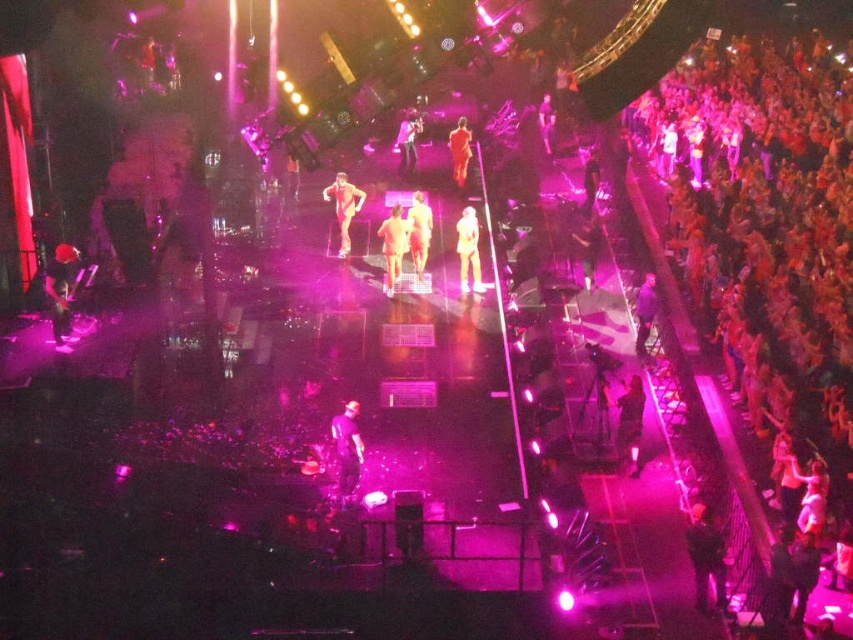
Between point (699, 568) and point (637, 317), which one is positioned behind?

The point (637, 317) is behind.

Which is more to the right, shiny black pants at center or matte black camera at right?

From the viewer's perspective, matte black camera at right appears more on the right side.

Locate an element on the screen. The height and width of the screenshot is (640, 853). shiny black pants at center is located at coordinates point(706,557).

Where is `shiny black pants at center`? shiny black pants at center is located at coordinates (706, 557).

Which is more to the right, matte black pants at center or matte black dress at center?

matte black dress at center

Who is more forward, (351,460) or (587,253)?

Point (351,460)

What are the coordinates of `matte black pants at center` in the screenshot? It's located at (347, 449).

Who is higher up, smooth beige dress at center or matte black suit at center?

matte black suit at center is higher up.

Is smooth beige dress at center below matte black suit at center?

Yes, smooth beige dress at center is below matte black suit at center.

Find the location of a particular element. Image resolution: width=853 pixels, height=640 pixels. smooth beige dress at center is located at coordinates (419, 230).

The width and height of the screenshot is (853, 640). Find the location of `smooth beige dress at center`. smooth beige dress at center is located at coordinates (419, 230).